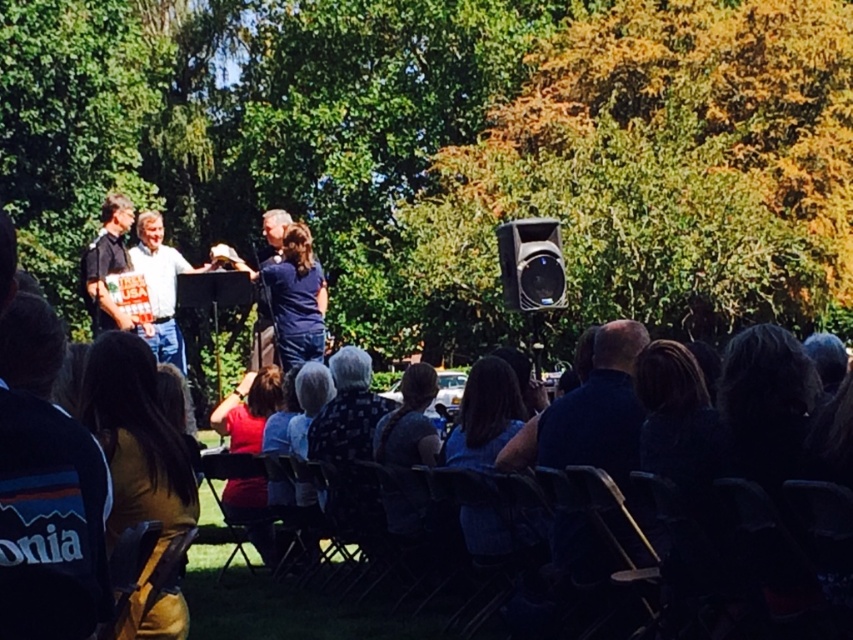
Does matte black speaker at center have a greater height compared to dark gray shirt at center?

Correct, matte black speaker at center is much taller as dark gray shirt at center.

Is point (544, 296) in front of point (405, 406)?

No, (544, 296) is behind (405, 406).

Does point (514, 250) come closer to viewer compared to point (389, 435)?

No, it is behind (389, 435).

The image size is (853, 640). Find the location of `matte black speaker at center`. matte black speaker at center is located at coordinates (531, 264).

In the scene shown: Is dark brown leather jacket at lower left positioned behind red shirt at center?

No, it is not.

Is dark brown leather jacket at lower left to the left of red shirt at center from the viewer's perspective?

Incorrect, dark brown leather jacket at lower left is not on the left side of red shirt at center.

Between point (117, 440) and point (267, 532), which one is positioned behind?

The point (267, 532) is behind.

What are the coordinates of `dark brown leather jacket at lower left` in the screenshot? It's located at (141, 480).

Does dark blue jacket at lower left appear over dark brown leather jacket at lower left?

Yes.

Can you confirm if dark blue jacket at lower left is smaller than dark brown leather jacket at lower left?

Correct, dark blue jacket at lower left occupies less space than dark brown leather jacket at lower left.

The height and width of the screenshot is (640, 853). Identify the location of dark blue jacket at lower left. (45, 490).